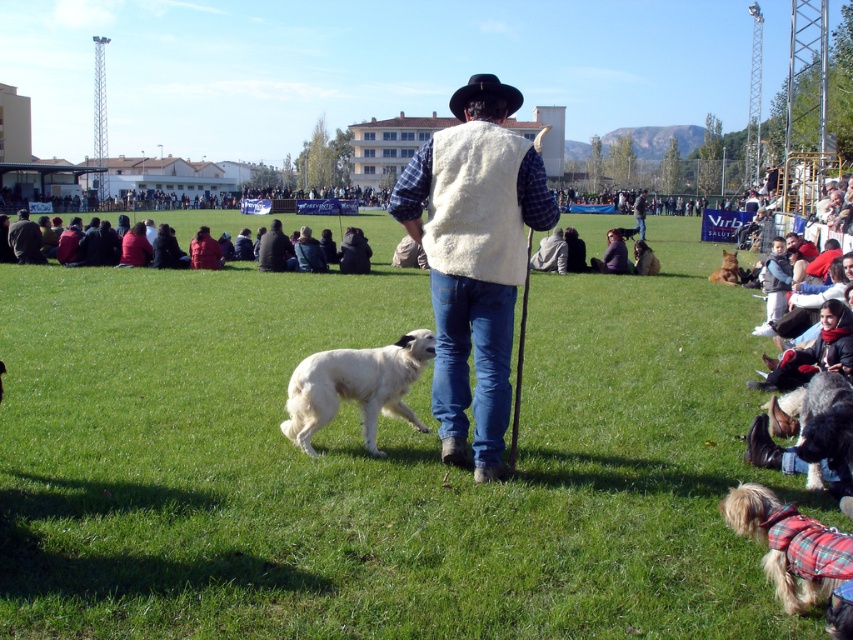
Is green grass at center above white fleece vest at center?

No.

Which is behind, point (335, 333) or point (527, 202)?

The point (335, 333) is more distant.

Is point (384, 557) behind point (502, 173)?

That is False.

Where is `green grass at center`? The image size is (853, 640). green grass at center is located at coordinates (376, 460).

Who is more forward, (405, 416) or (811, 520)?

Point (811, 520)

Is point (335, 381) positioned in front of point (815, 547)?

No, (335, 381) is behind (815, 547).

What do you see at coordinates (355, 387) in the screenshot? This screenshot has height=640, width=853. I see `white fluffy dog at center` at bounding box center [355, 387].

Identify the location of white fluffy dog at center. (355, 387).

Is point (434, 230) positioned in front of point (726, 260)?

Yes, it is in front of point (726, 260).

Which of these two, white fleece vest at center or fuzzy brown dog at lower right, stands taller?

white fleece vest at center

Does point (466, 307) come behind point (724, 257)?

That is False.

Locate an element on the screen. Image resolution: width=853 pixels, height=640 pixels. white fleece vest at center is located at coordinates (474, 257).